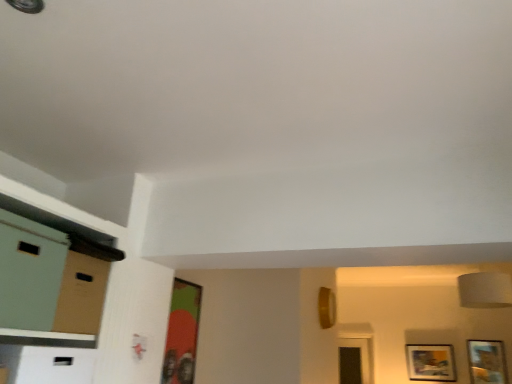
Question: From their relative heights in the image, would you say green matte picture frame at center, acting as the first picture frame starting from the front, is taller or shorter than matte green file cabinet at left?

Choices:
 (A) short
 (B) tall

Answer: (B)

Question: Considering their positions, is green matte picture frame at center, the first picture frame in the left-to-right sequence, located in front of or behind matte green file cabinet at left?

Choices:
 (A) front
 (B) behind

Answer: (B)

Question: Which is nearer to the wooden picture frame at lower right, which appears as the third picture frame when viewed from the top?

Choices:
 (A) matte green file cabinet at left
 (B) green matte picture frame at center, acting as the first picture frame starting from the front
 (C) wooden framed picture at lower right, positioned as the 1th picture frame in right-to-left order
 (D) matte cardboard dresser at left

Answer: (C)

Question: Estimate the real-world distances between objects in this image. Which object is farther from the wooden framed picture at lower right, which is the second picture frame in back-to-front order?

Choices:
 (A) wooden picture frame at lower right, placed as the 2th picture frame when sorted from left to right
 (B) matte green file cabinet at left
 (C) matte cardboard dresser at left
 (D) green matte picture frame at center, the first picture frame in the left-to-right sequence

Answer: (B)